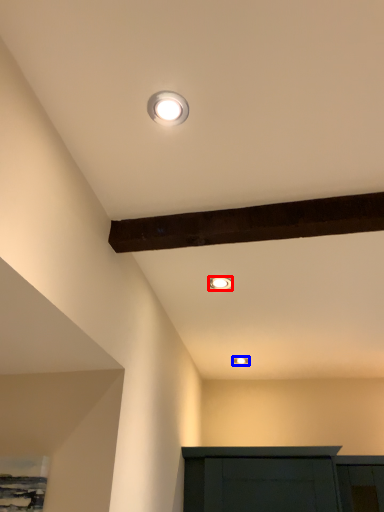
Question: Which point is closer to the camera, lamp (highlighted by a red box) or lamp (highlighted by a blue box)?

Choices:
 (A) lamp
 (B) lamp

Answer: (A)